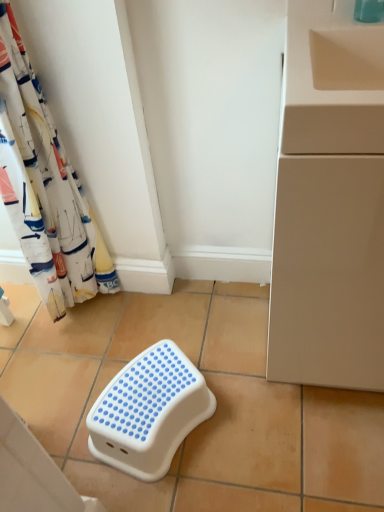
At what (x,y) coordinates should I click in order to perform the action: click on free location in front of beige matte cabinet at right. Please return your answer as a coordinate pair (x, y). Looking at the image, I should click on (317, 451).